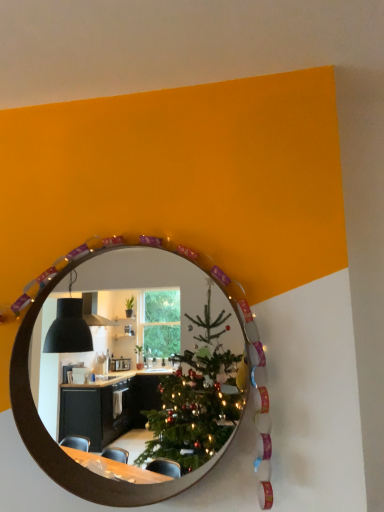
Describe the element at coordinates (149, 353) in the screenshot. I see `wooden mirror at center` at that location.

You are a GUI agent. You are given a task and a screenshot of the screen. Output one action in this format:
    pyautogui.click(x=<x>, y=<y>)
    Task: Click on the wooden mirror at center
    The height and width of the screenshot is (512, 384).
    Given the screenshot: What is the action you would take?
    pyautogui.click(x=149, y=353)

Find the location of a particular element. wooden mirror at center is located at coordinates (149, 353).